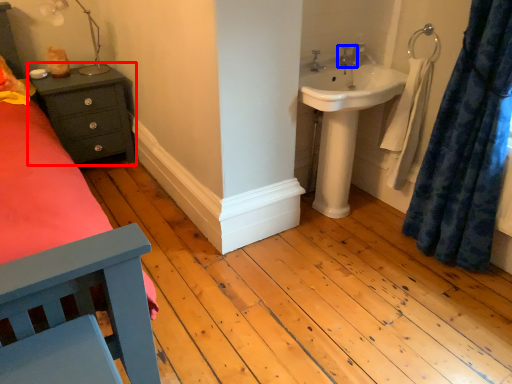
Question: Among these objects, which one is farthest to the camera, nightstand (highlighted by a red box) or tap (highlighted by a blue box)?

Choices:
 (A) nightstand
 (B) tap

Answer: (A)